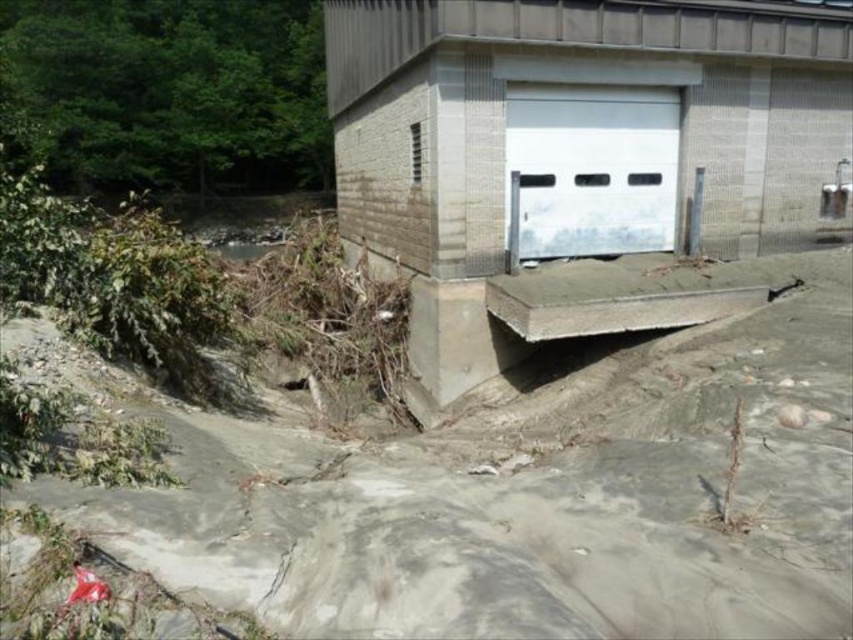
Question: Is gray concrete at lower center below white smooth garage door at center?

Choices:
 (A) no
 (B) yes

Answer: (B)

Question: Is gray concrete at lower center above white matte garage door at center?

Choices:
 (A) no
 (B) yes

Answer: (A)

Question: Which point appears farthest from the camera in this image?

Choices:
 (A) (239, 589)
 (B) (828, 179)

Answer: (B)

Question: Which point appears farthest from the camera in this image?

Choices:
 (A) (456, 61)
 (B) (672, 134)

Answer: (B)

Question: Based on their relative distances, which object is farther from the gray concrete at lower center?

Choices:
 (A) white matte garage door at center
 (B) white smooth garage door at center

Answer: (A)

Question: Is gray concrete at lower center closer to the viewer compared to white smooth garage door at center?

Choices:
 (A) no
 (B) yes

Answer: (B)